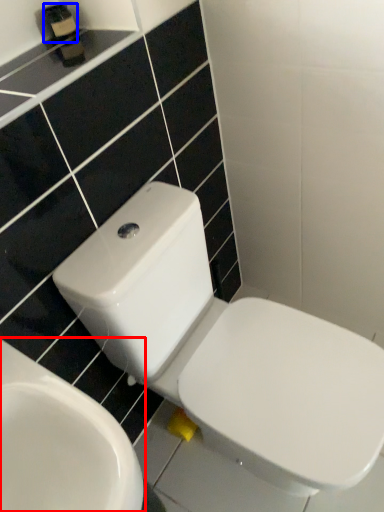
Question: Which of the following is the farthest to the observer, toilet (highlighted by a red box) or toiletry (highlighted by a blue box)?

Choices:
 (A) toilet
 (B) toiletry

Answer: (B)